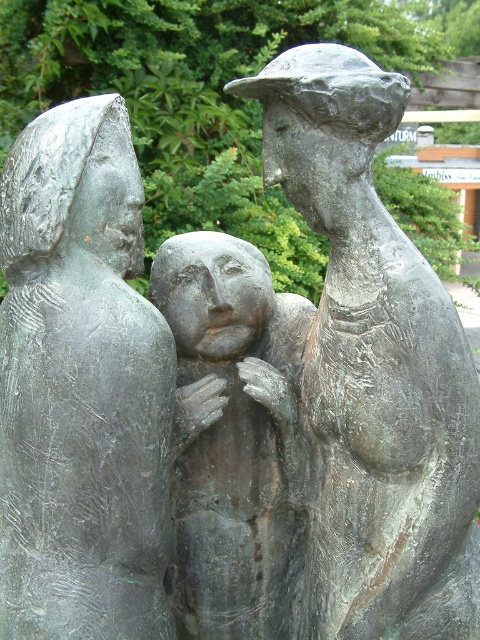
Question: Can you confirm if bronze statue at upper right is bigger than bronze sculpture at center?

Choices:
 (A) yes
 (B) no

Answer: (A)

Question: Among these objects, which one is nearest to the camera?

Choices:
 (A) bronze textured figure at left
 (B) bronze statue at upper right

Answer: (A)

Question: Which point is farther to the camera?

Choices:
 (A) bronze sculpture at center
 (B) bronze textured figure at left
 (C) bronze statue at upper right

Answer: (A)

Question: Is the position of bronze textured figure at left less distant than that of bronze statue at upper right?

Choices:
 (A) yes
 (B) no

Answer: (A)

Question: Among these objects, which one is nearest to the camera?

Choices:
 (A) bronze statue at upper right
 (B) bronze textured figure at left

Answer: (B)

Question: Is bronze textured figure at left thinner than bronze sculpture at center?

Choices:
 (A) yes
 (B) no

Answer: (B)